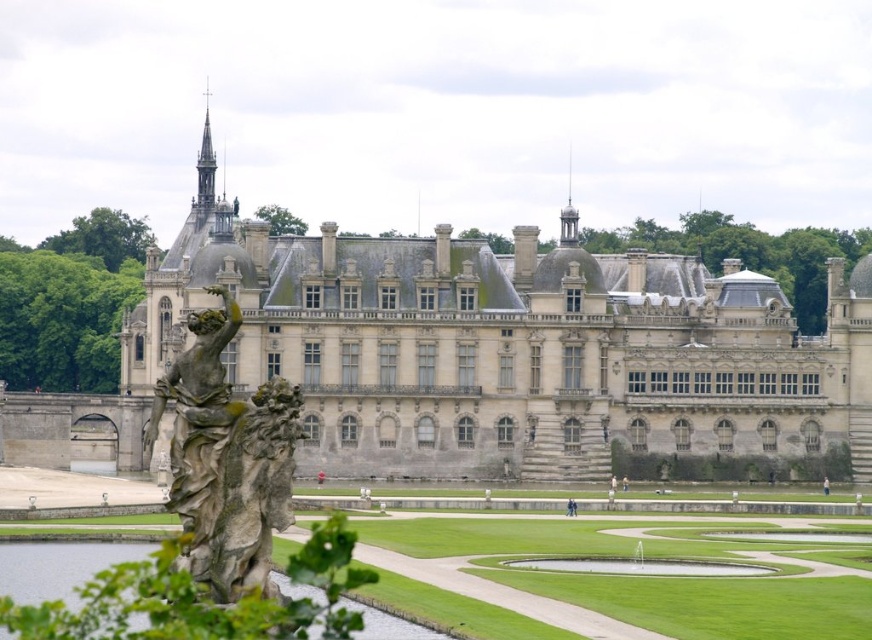
Question: Is stone castle at center below clear water at statue left?

Choices:
 (A) no
 (B) yes

Answer: (A)

Question: Considering the real-world distances, which object is closest to the stone castle at center?

Choices:
 (A) clear water at statue left
 (B) stone statue at left

Answer: (B)

Question: Which object is farther from the camera taking this photo?

Choices:
 (A) stone statue at left
 (B) clear water at statue left

Answer: (A)

Question: Is stone statue at left further to camera compared to clear water at statue left?

Choices:
 (A) no
 (B) yes

Answer: (B)

Question: Does stone statue at left appear under clear water at statue left?

Choices:
 (A) no
 (B) yes

Answer: (A)

Question: Which of these objects is positioned closest to the stone castle at center?

Choices:
 (A) stone statue at left
 (B) clear water at statue left

Answer: (A)